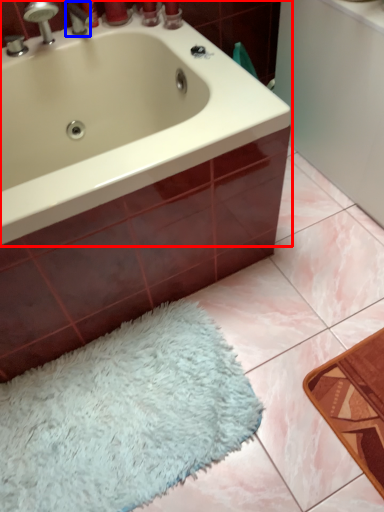
Question: Which object is further to the camera taking this photo, bathtub (highlighted by a red box) or tap (highlighted by a blue box)?

Choices:
 (A) bathtub
 (B) tap

Answer: (B)